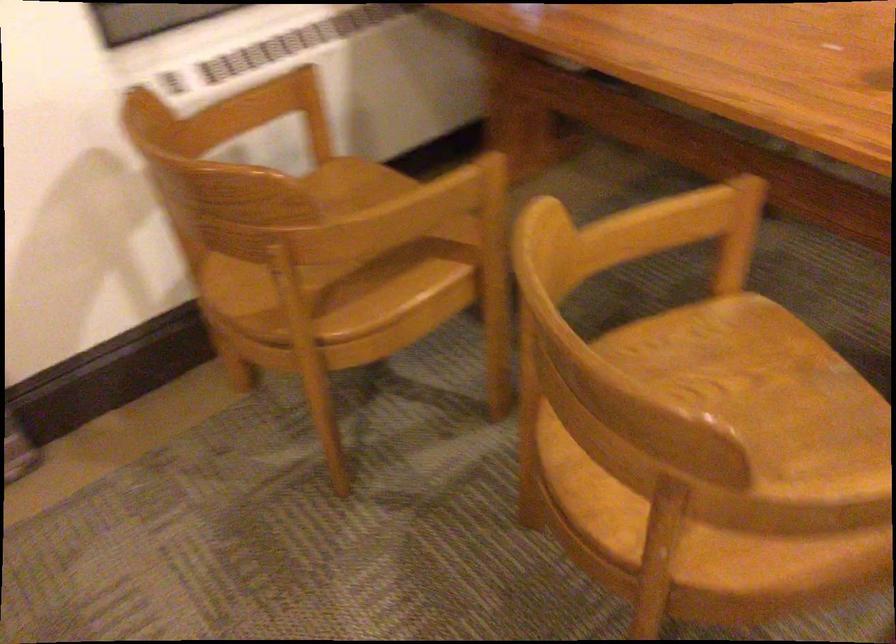
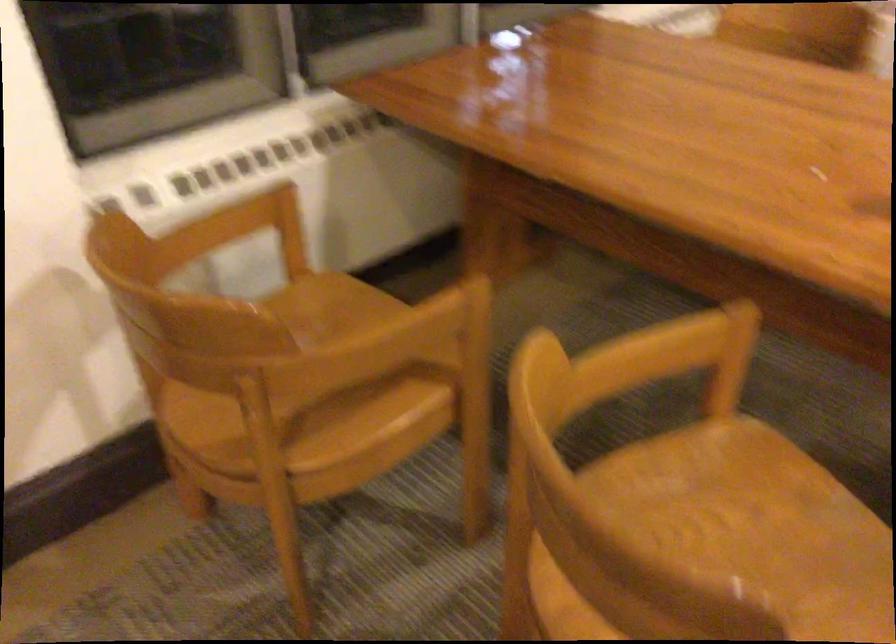
Which direction would the cameraman need to move to produce the second image?

The cameraman moved toward left, forward.